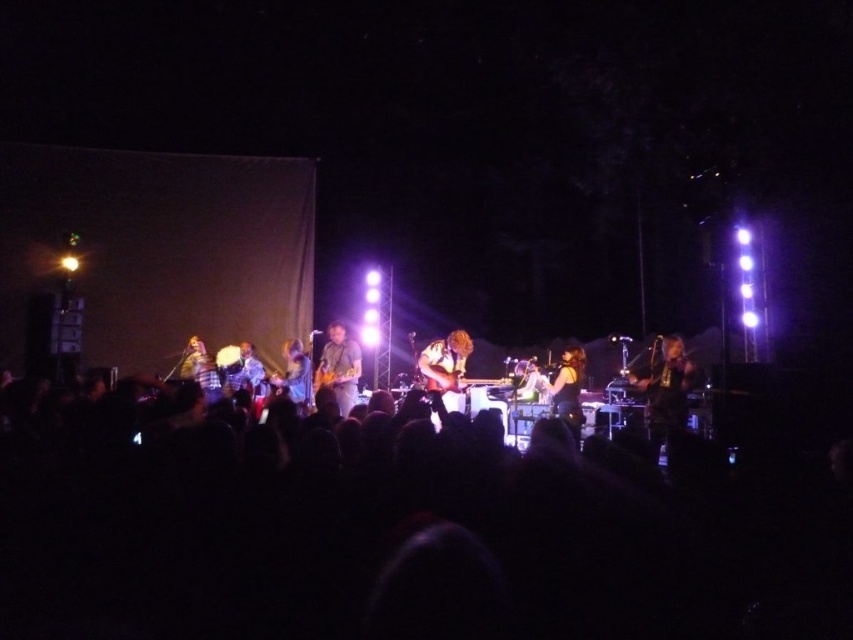
Can you confirm if shiny brown guitar at center is taller than shiny silver guitar at center?

Yes.

Can you confirm if shiny brown guitar at center is positioned to the left of shiny silver guitar at center?

In fact, shiny brown guitar at center is to the right of shiny silver guitar at center.

Describe the element at coordinates (445, 369) in the screenshot. I see `shiny brown guitar at center` at that location.

Find the location of a particular element. The height and width of the screenshot is (640, 853). shiny brown guitar at center is located at coordinates (445, 369).

Is light brown leather guitar at center wider than shiny silver guitar at center?

Incorrect, light brown leather guitar at center's width does not surpass shiny silver guitar at center's.

Is light brown leather guitar at center shorter than shiny silver guitar at center?

Incorrect, light brown leather guitar at center's height does not fall short of shiny silver guitar at center's.

Is point (357, 352) farther from viewer compared to point (309, 376)?

Yes, it is behind point (309, 376).

The image size is (853, 640). I want to click on light brown leather guitar at center, so click(339, 368).

Does shiny black guitar at right have a greater width compared to shiny brown guitar at center?

Yes, shiny black guitar at right is wider than shiny brown guitar at center.

Is shiny black guitar at right positioned at the back of shiny brown guitar at center?

No, it is in front of shiny brown guitar at center.

Which is behind, point (672, 346) or point (460, 381)?

Positioned behind is point (460, 381).

The width and height of the screenshot is (853, 640). Find the location of `shiny black guitar at right`. shiny black guitar at right is located at coordinates (665, 392).